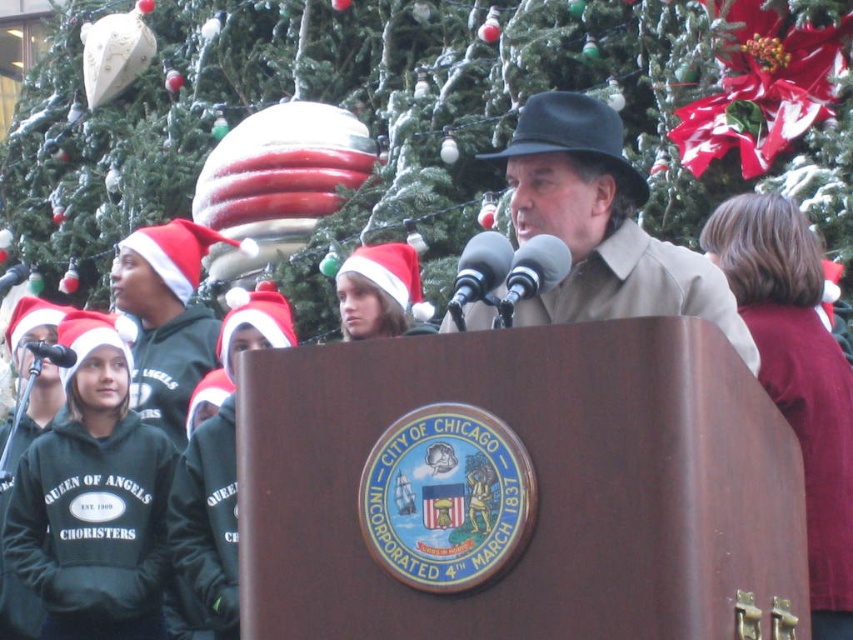
Question: Which of the following is the farthest from the observer?

Choices:
 (A) black felt hat at center
 (B) black matte microphone at left
 (C) matte brown coat at center
 (D) white fabric santa hat at left

Answer: (D)

Question: Which is nearer to the green textured christmas tree at upper center?

Choices:
 (A) black felt hat at center
 (B) metallic silver microphone at center
 (C) metallic silver microphones at center
 (D) matte brown coat at center

Answer: (A)

Question: In this image, where is white fabric santa hat at left located relative to black matte microphone at left?

Choices:
 (A) above
 (B) below

Answer: (A)

Question: Is the position of white fabric santa hat at left less distant than that of metallic silver microphone at center?

Choices:
 (A) yes
 (B) no

Answer: (B)

Question: Which object is farther from the camera taking this photo?

Choices:
 (A) black felt hat at center
 (B) green textured christmas tree at upper center

Answer: (B)

Question: Can you confirm if green textured christmas tree at upper center is positioned to the left of metallic silver microphones at center?

Choices:
 (A) no
 (B) yes

Answer: (B)